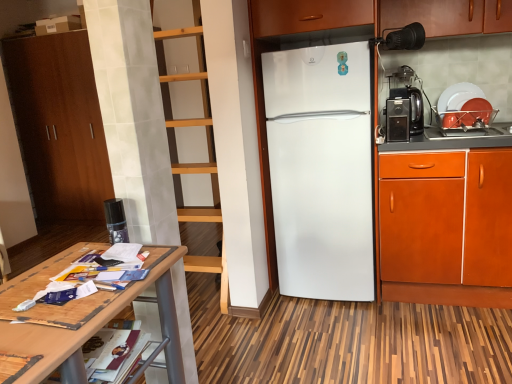
Question: From the image's perspective, is satin black spray can at left, arranged as the first appliance when viewed from the front, located above wooden table at lower left?

Choices:
 (A) yes
 (B) no

Answer: (A)

Question: Can you confirm if satin black spray can at left, placed as the first appliance when sorted from bottom to top, is shorter than wooden table at lower left?

Choices:
 (A) yes
 (B) no

Answer: (A)

Question: Does satin black spray can at left, arranged as the first appliance when viewed from the front, have a larger size compared to wooden table at lower left?

Choices:
 (A) yes
 (B) no

Answer: (B)

Question: Is satin black spray can at left, arranged as the first appliance when viewed from the front, not near wooden table at lower left?

Choices:
 (A) yes
 (B) no

Answer: (B)

Question: Could you tell me if satin black spray can at left, placed as the first appliance when sorted from bottom to top, is facing wooden table at lower left?

Choices:
 (A) no
 (B) yes

Answer: (A)

Question: Does satin black spray can at left, arranged as the 1th appliance when viewed from the left, have a greater width compared to wooden table at lower left?

Choices:
 (A) no
 (B) yes

Answer: (A)

Question: From the image's perspective, is brown wood cabinet at left, acting as the first cabinetry starting from the left, above black plastic coffee machine at right?

Choices:
 (A) yes
 (B) no

Answer: (A)

Question: Is brown wood cabinet at left, which is the second cabinetry in front-to-back order, positioned in front of black plastic coffee machine at right?

Choices:
 (A) yes
 (B) no

Answer: (B)

Question: Is the surface of brown wood cabinet at left, which is the second cabinetry in front-to-back order, in direct contact with black plastic coffee machine at right?

Choices:
 (A) no
 (B) yes

Answer: (A)

Question: Considering the relative sizes of brown wood cabinet at left, positioned as the first cabinetry in back-to-front order, and black plastic coffee machine at right in the image provided, is brown wood cabinet at left, positioned as the first cabinetry in back-to-front order, thinner than black plastic coffee machine at right?

Choices:
 (A) no
 (B) yes

Answer: (A)

Question: Does brown wood cabinet at left, positioned as the first cabinetry in back-to-front order, have a greater width compared to black plastic coffee machine at right?

Choices:
 (A) no
 (B) yes

Answer: (B)

Question: From a real-world perspective, is brown wood cabinet at left, acting as the first cabinetry starting from the left, under black plastic coffee machine at right?

Choices:
 (A) yes
 (B) no

Answer: (A)

Question: Is brown wood cabinet at left, which is the second cabinetry in front-to-back order, smaller than orange wood cabinet at right, arranged as the 1th cabinetry when viewed from the right?

Choices:
 (A) no
 (B) yes

Answer: (A)